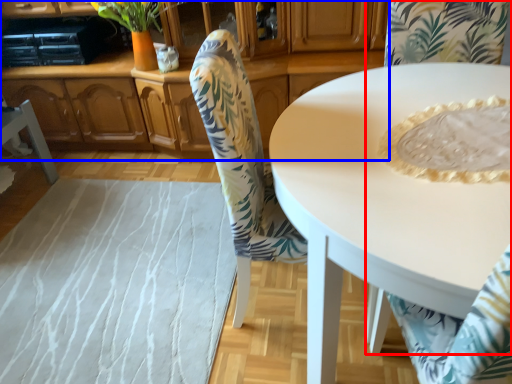
Question: Which of the following is the farthest to the observer, chair (highlighted by a red box) or cabinetry (highlighted by a blue box)?

Choices:
 (A) chair
 (B) cabinetry

Answer: (B)